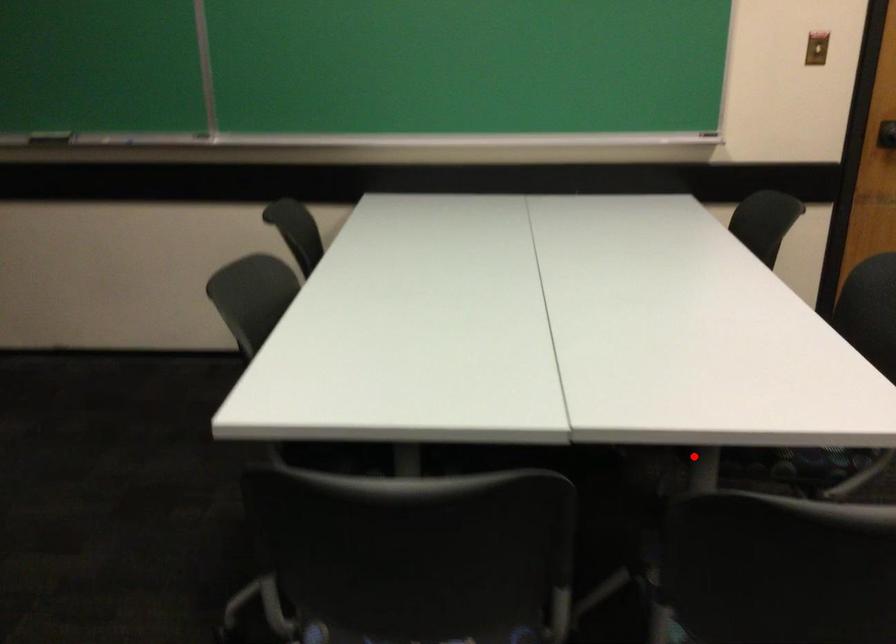
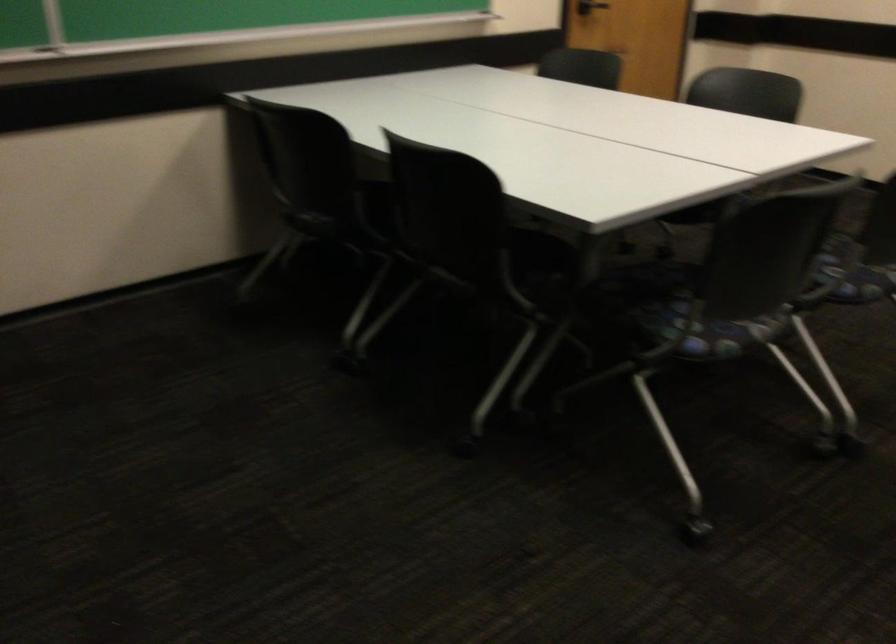
In the second image, find the point that corresponds to the highlighted location in the first image.

(703, 214)